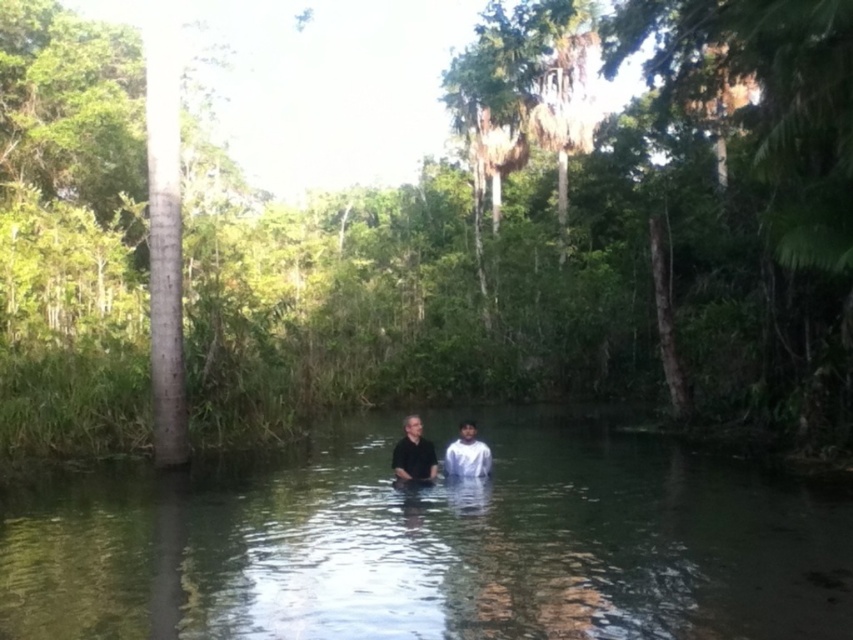
Question: Which is farther from the white matte shirt at center?

Choices:
 (A) clear water at center
 (B) black matte shirt at center

Answer: (A)

Question: Based on their relative distances, which object is nearer to the black matte shirt at center?

Choices:
 (A) clear water at center
 (B) green leafy jungle at center
 (C) white matte shirt at center

Answer: (C)

Question: Where is clear water at center located in relation to white matte shirt at center in the image?

Choices:
 (A) right
 (B) left

Answer: (B)

Question: Which point is farther to the camera?

Choices:
 (A) (409, 465)
 (B) (45, 401)
 (C) (457, 472)

Answer: (B)

Question: Where is green leafy jungle at center located in relation to black matte shirt at center in the image?

Choices:
 (A) above
 (B) below

Answer: (A)

Question: Can you confirm if green leafy jungle at center is bigger than white matte shirt at center?

Choices:
 (A) no
 (B) yes

Answer: (B)